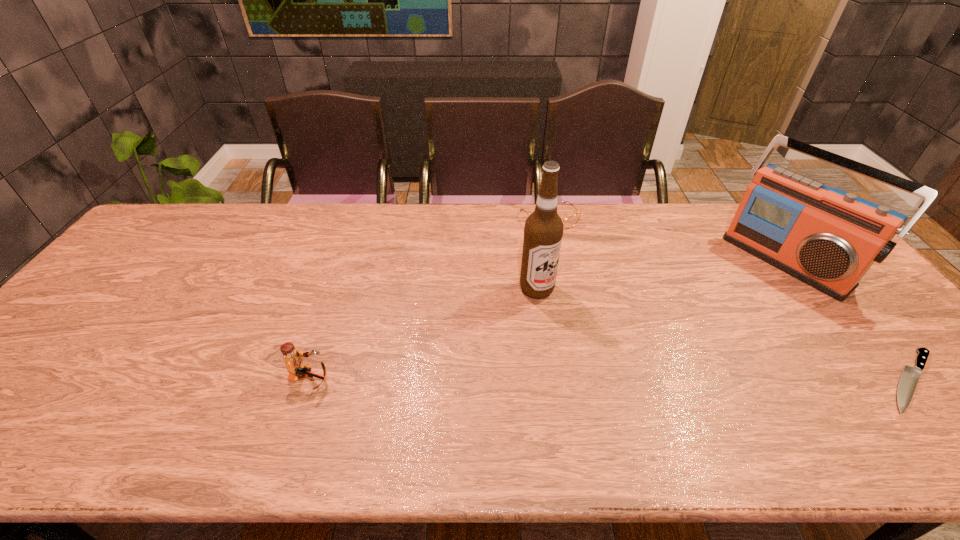
Locate an element on the screen. This screenshot has height=540, width=960. Lego is located at coordinates click(x=296, y=367).

Where is `the leftmost object`? The image size is (960, 540). the leftmost object is located at coordinates (296, 367).

Locate an element on the screen. spectacles is located at coordinates 569,222.

Image resolution: width=960 pixels, height=540 pixels. Find the location of `the tallest object`. the tallest object is located at coordinates (543, 231).

The height and width of the screenshot is (540, 960). I want to click on the second tallest object, so click(x=828, y=238).

Where is `vacant space situated 0.170m holding a crossbow in the hands of the third tallest object`? vacant space situated 0.170m holding a crossbow in the hands of the third tallest object is located at coordinates (403, 379).

Image resolution: width=960 pixels, height=540 pixels. Find the location of `free space located 0.290m on the front-facing side of the fourth tallest object`. free space located 0.290m on the front-facing side of the fourth tallest object is located at coordinates 605,293.

This screenshot has width=960, height=540. What are the coordinates of `free space located 0.060m on the front-facing side of the fourth tallest object` in the screenshot? It's located at (569, 244).

Locate an element on the screen. The width and height of the screenshot is (960, 540). free space located 0.220m on the front-facing side of the fourth tallest object is located at coordinates (593, 277).

Where is `free location located 0.270m on the label of the tallest object`? free location located 0.270m on the label of the tallest object is located at coordinates (635, 356).